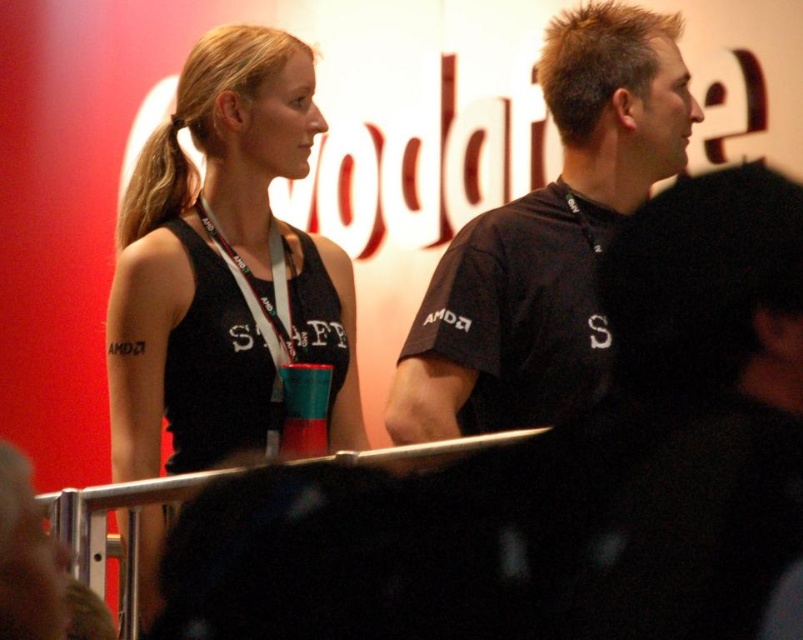
Identify the location of black matte tank top at upper left. This screenshot has width=803, height=640. (225, 268).

Does point (217, 125) come closer to viewer compared to point (673, 38)?

No, it is behind (673, 38).

Which is behind, point (212, 364) or point (575, 10)?

The point (575, 10) is more distant.

What are the coordinates of `black matte tank top at upper left` in the screenshot? It's located at click(225, 268).